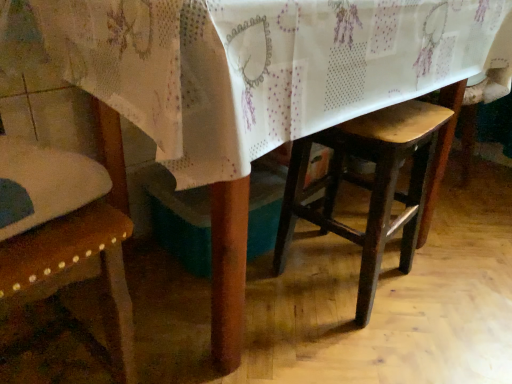
Question: Visually, is wooden stool at center positioned to the left or to the right of wooden chair at left?

Choices:
 (A) left
 (B) right

Answer: (B)

Question: From a real-world perspective, is wooden stool at center positioned above or below wooden chair at left?

Choices:
 (A) below
 (B) above

Answer: (A)

Question: Which is correct: wooden stool at center is inside wooden chair at left, or outside of it?

Choices:
 (A) outside
 (B) inside

Answer: (A)

Question: Is point (18, 243) closer or farther from the camera than point (361, 135)?

Choices:
 (A) closer
 (B) farther

Answer: (A)

Question: In terms of height, does wooden chair at left look taller or shorter compared to wooden stool at center?

Choices:
 (A) tall
 (B) short

Answer: (A)

Question: Is wooden chair at left in front of or behind wooden stool at center in the image?

Choices:
 (A) behind
 (B) front

Answer: (B)

Question: Looking at the image, does wooden chair at left seem bigger or smaller compared to wooden stool at center?

Choices:
 (A) big
 (B) small

Answer: (A)